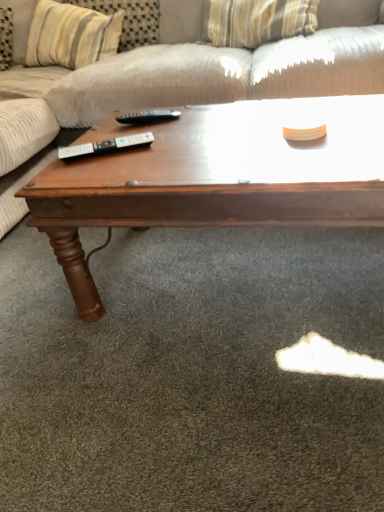
At what (x,y) coordinates should I click in order to perform the action: click on free space in front of black plastic remote at center, which is the 1th remote from bottom to top. Please return your answer as a coordinate pair (x, y). Looking at the image, I should click on click(108, 173).